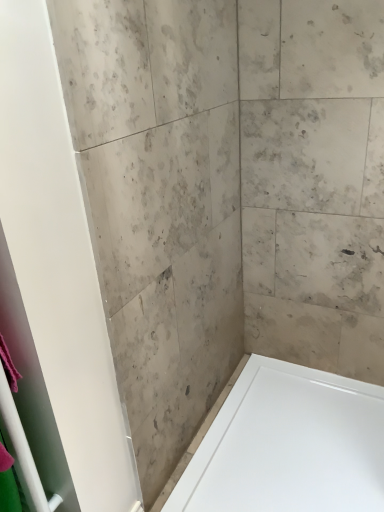
Question: Based on their positions, is pink fabric at left located to the left or right of white glossy bathtub at lower right?

Choices:
 (A) right
 (B) left

Answer: (B)

Question: Considering the positions of pink fabric at left and white glossy bathtub at lower right in the image, is pink fabric at left bigger or smaller than white glossy bathtub at lower right?

Choices:
 (A) big
 (B) small

Answer: (B)

Question: In the image, is pink fabric at left positioned in front of or behind white glossy bathtub at lower right?

Choices:
 (A) front
 (B) behind

Answer: (A)

Question: Looking at the image, does white glossy bathtub at lower right seem bigger or smaller compared to pink fabric at left?

Choices:
 (A) small
 (B) big

Answer: (B)

Question: Is white glossy bathtub at lower right wider or thinner than pink fabric at left?

Choices:
 (A) thin
 (B) wide

Answer: (B)

Question: Is white glossy bathtub at lower right spatially inside pink fabric at left, or outside of it?

Choices:
 (A) inside
 (B) outside

Answer: (B)

Question: From the image's perspective, is white glossy bathtub at lower right positioned above or below pink fabric at left?

Choices:
 (A) below
 (B) above

Answer: (A)